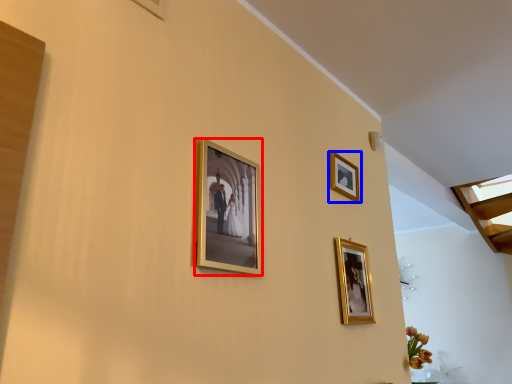
Question: Which object appears farthest to the camera in this image, picture frame (highlighted by a red box) or picture frame (highlighted by a blue box)?

Choices:
 (A) picture frame
 (B) picture frame

Answer: (B)